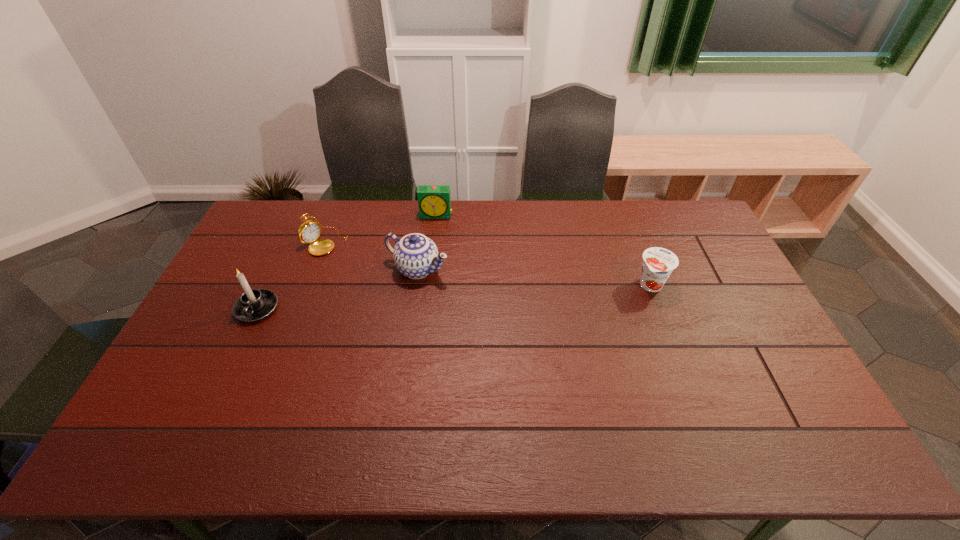
Identify the location of free space on the desktop that is between the candle holder and the rightmost object and is positioned at the spout of the chinaware. The height and width of the screenshot is (540, 960). (481, 295).

You are a GUI agent. You are given a task and a screenshot of the screen. Output one action in this format:
    pyautogui.click(x=<x>, y=<y>)
    Task: Click on the free space on the desktop that is between the tallest object and the yogurt and is positioned on the front-facing side of the farthest object
    The image size is (960, 540).
    Given the screenshot: What is the action you would take?
    pyautogui.click(x=424, y=299)

Find the location of a particular element. This screenshot has width=960, height=540. vacant space on the desktop that is between the tallest object and the rightmost object and is positioned on the face of the pocket watch is located at coordinates coord(417,299).